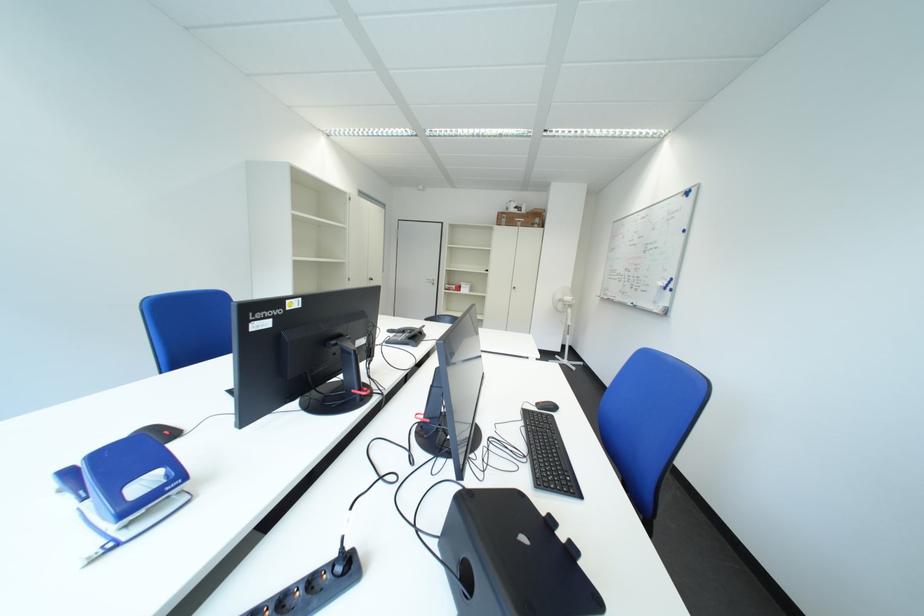
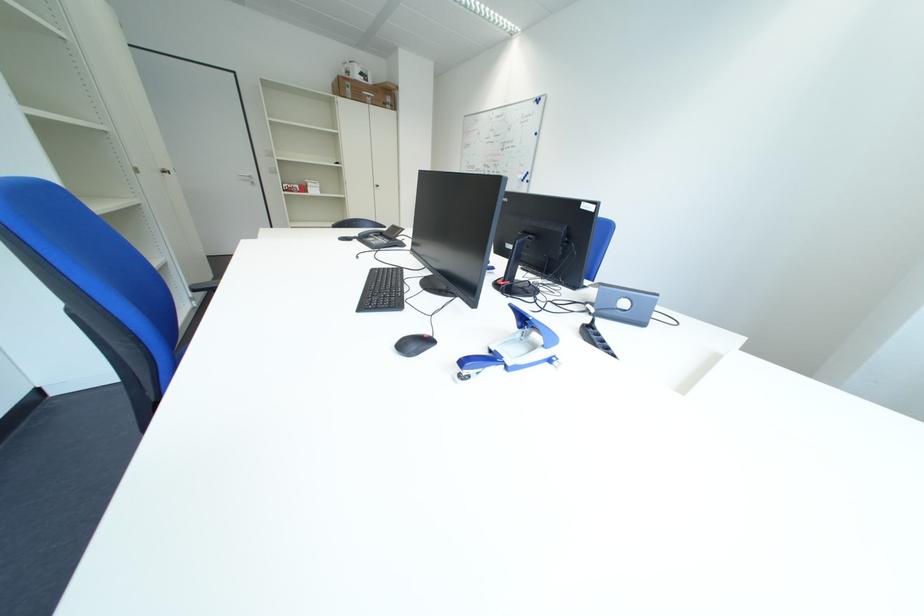
Where in the second image is the point corresponding to point (517, 223) from the first image?

(360, 92)